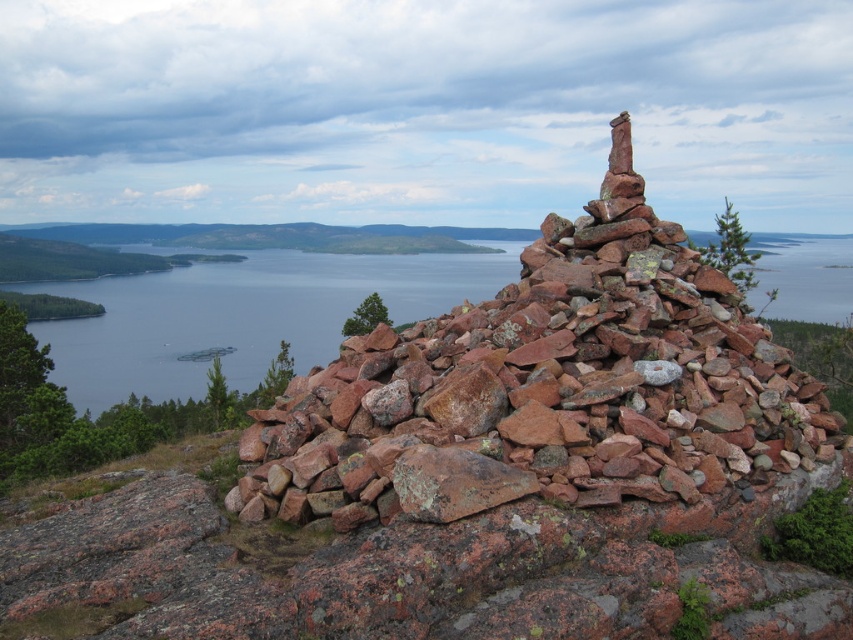
You are standing at the edge of the clear blue water at center and want to reach the rusty stone stack at center. Which direction should you move to get there?

You should move to the right because the rusty stone stack at center is positioned on the right side of the clear blue water at center.